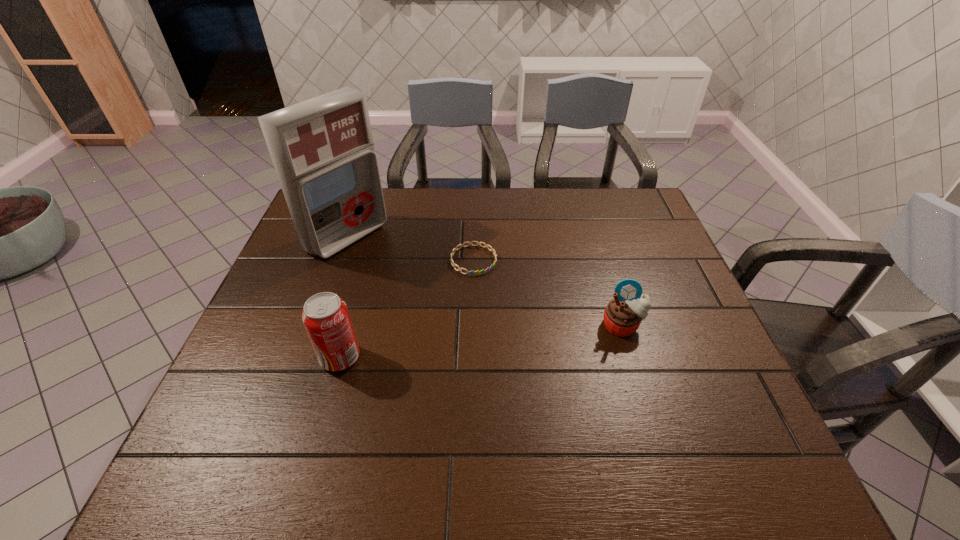
Image resolution: width=960 pixels, height=540 pixels. I want to click on empty space between the nearest object and the muffin, so click(x=481, y=342).

At what (x,y) coordinates should I click in order to perform the action: click on vacant space in between the third farthest object and the first-aid kit. Please return your answer as a coordinate pair (x, y). Image resolution: width=960 pixels, height=540 pixels. Looking at the image, I should click on (485, 281).

What are the coordinates of `free spot between the muffin and the tallest object` in the screenshot? It's located at (485, 281).

What are the coordinates of `free space between the third object from left to right and the soda can` in the screenshot? It's located at (407, 309).

The image size is (960, 540). I want to click on vacant area between the shortest object and the third farthest object, so click(548, 293).

I want to click on vacant area that lies between the second nearest object and the tallest object, so click(x=485, y=281).

Where is `object that is the closest to the shortest object`? This screenshot has height=540, width=960. object that is the closest to the shortest object is located at coordinates (322, 149).

Find the location of a particular element. object that is the closest one to the soda can is located at coordinates (322, 149).

At what (x,y) coordinates should I click in order to perform the action: click on vacant space that satisfies the following two spatial constraints: 1. on the front side of the soda can; 2. on the logo side of the tallest object. Please return your answer as a coordinate pair (x, y). Looking at the image, I should click on (305, 357).

Locate an element on the screen. This screenshot has height=540, width=960. free space that satisfies the following two spatial constraints: 1. on the front side of the nearest object; 2. on the logo side of the first-aid kit is located at coordinates (305, 357).